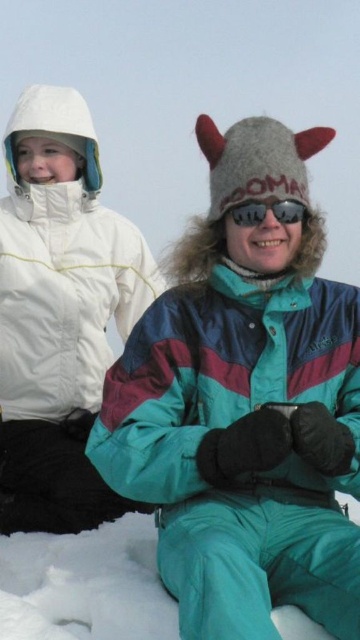
Measure the distance between point (92,128) and camera.

Point (92,128) and camera are 4.04 meters apart.

Does white matte jacket at upper left come in front of sunglasses at center?

No, it is behind sunglasses at center.

Identify the location of white matte jacket at upper left. click(x=60, y=314).